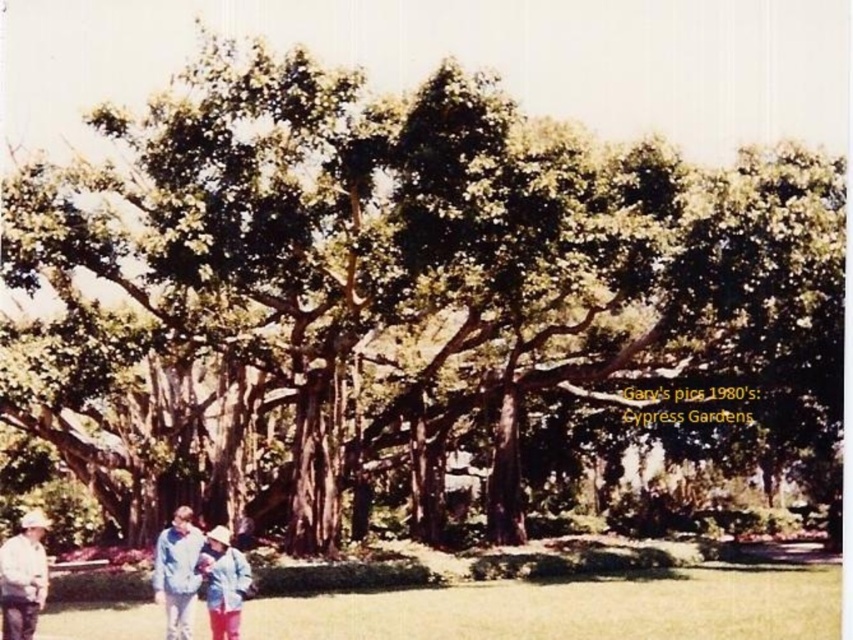
Question: Which object is the closest to the light blue denim jacket at lower left?

Choices:
 (A) white cotton shirt at lower left
 (B) light blue denim jacket at lower center

Answer: (B)

Question: Which object is positioned closest to the white cotton shirt at lower left?

Choices:
 (A) light blue denim jacket at lower left
 (B) light blue denim jacket at lower center

Answer: (B)

Question: Is white cotton shirt at lower left to the right of light blue denim jacket at lower center from the viewer's perspective?

Choices:
 (A) yes
 (B) no

Answer: (B)

Question: Is white cotton shirt at lower left thinner than light blue denim jacket at lower center?

Choices:
 (A) no
 (B) yes

Answer: (A)

Question: Is light blue denim jacket at lower left below light blue denim jacket at lower center?

Choices:
 (A) no
 (B) yes

Answer: (B)

Question: Which of the following is the closest to the observer?

Choices:
 (A) light blue denim jacket at lower center
 (B) light blue denim jacket at lower left
 (C) white cotton shirt at lower left

Answer: (A)